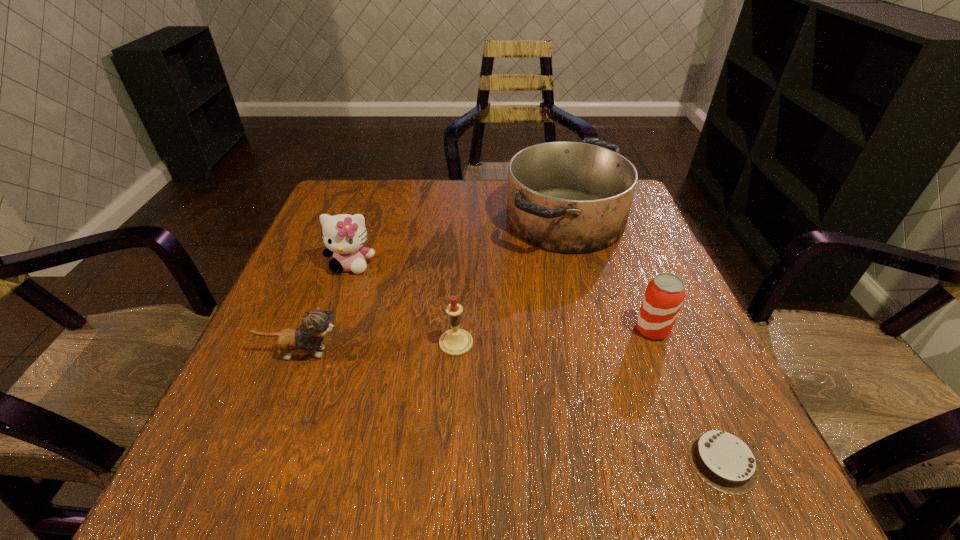
What are the coordinates of `free space located on the back of the candle` in the screenshot? It's located at (461, 249).

Find the location of a particular element. This screenshot has width=960, height=540. blank space located 0.220m on the front-facing side of the nearer kitten is located at coordinates (462, 353).

You are a GUI agent. You are given a task and a screenshot of the screen. Output one action in this format:
    pyautogui.click(x=<x>, y=<y>)
    Task: Click on the free spot located 0.310m on the back of the shortest object
    This screenshot has height=540, width=960.
    Given the screenshot: What is the action you would take?
    pyautogui.click(x=653, y=298)

The width and height of the screenshot is (960, 540). Identify the location of object that is at the far edge. (568, 197).

Where is `object located in the near edge section of the desktop`? This screenshot has width=960, height=540. object located in the near edge section of the desktop is located at coordinates (724, 461).

Locate an element on the screen. saucepan that is at the right edge is located at coordinates (568, 197).

This screenshot has width=960, height=540. In order to click on beer can located at the right edge in this screenshot , I will do `click(664, 296)`.

You are a GUI agent. You are given a task and a screenshot of the screen. Output one action in this format:
    pyautogui.click(x=<x>, y=<y>)
    Task: Click on the chocolate cake at the right edge
    Image resolution: width=960 pixels, height=540 pixels.
    Given the screenshot: What is the action you would take?
    pyautogui.click(x=724, y=461)

I want to click on object present at the far right corner, so click(568, 197).

Where is `object that is at the near right corner`? The width and height of the screenshot is (960, 540). object that is at the near right corner is located at coordinates (724, 461).